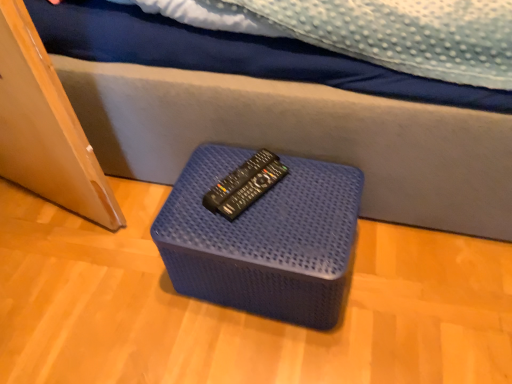
The image size is (512, 384). In order to click on free space in front of black plastic remote at center in this screenshot , I will do `click(254, 232)`.